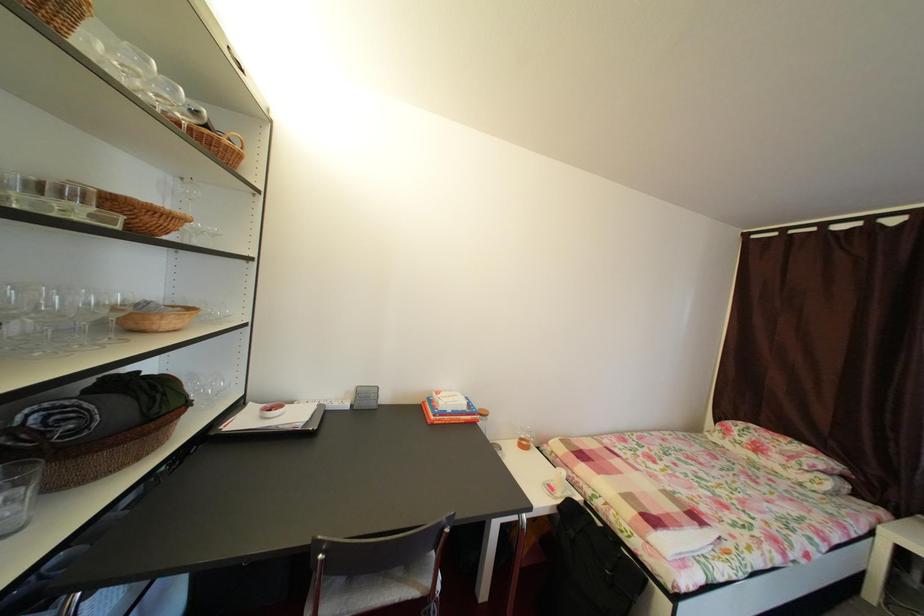
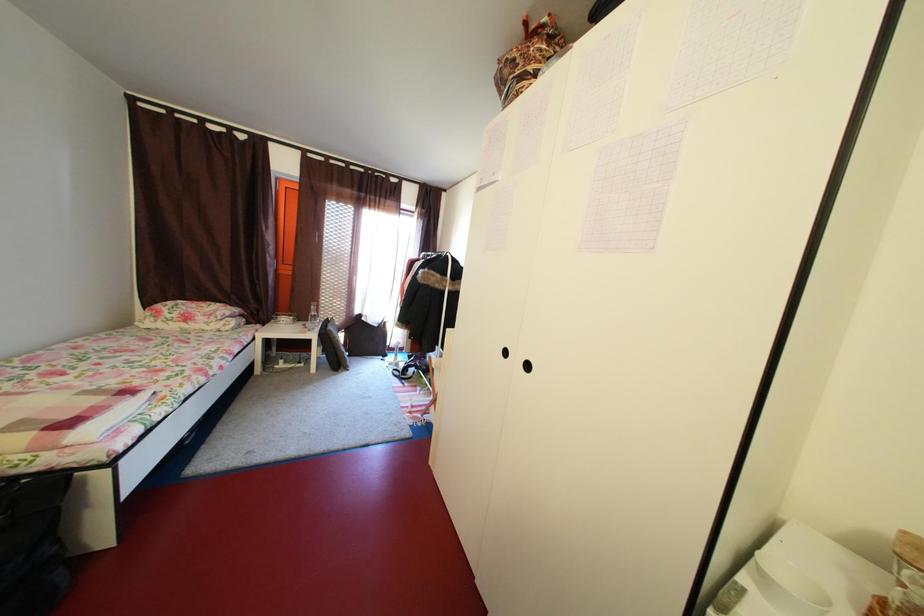
Based on the continuous images, in which direction is the camera rotating?

The camera's rotation is toward right-down.